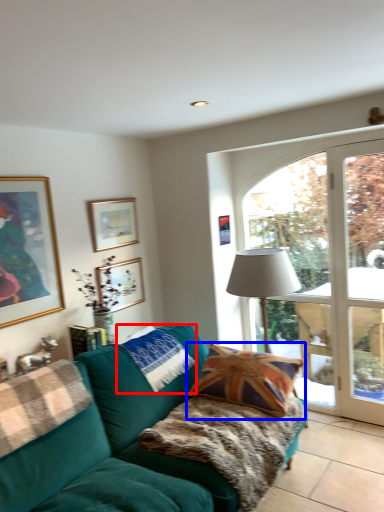
Question: Which object is further to the camera taking this photo, pillow (highlighted by a red box) or pillow (highlighted by a blue box)?

Choices:
 (A) pillow
 (B) pillow

Answer: (A)